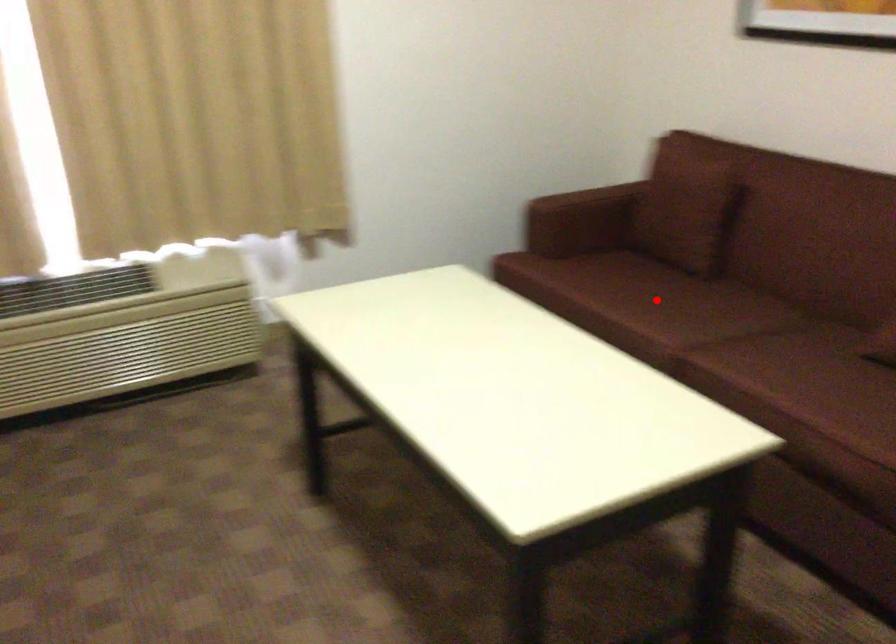
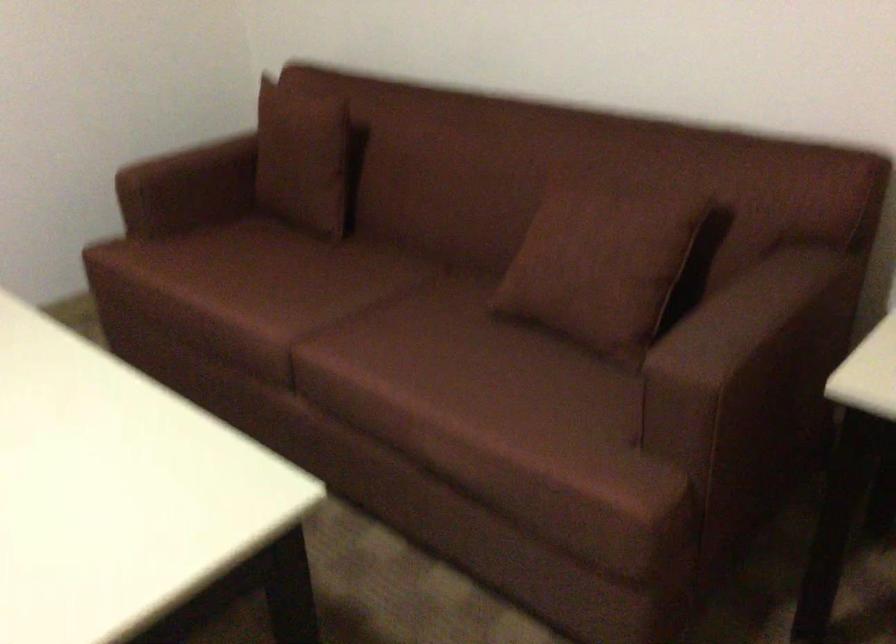
Question: I am providing you with two images of the same scene from different viewpoints. A red point is marked on the first image. Is the red point's position out of view in image 2?

Choices:
 (A) Yes
 (B) No

Answer: (B)